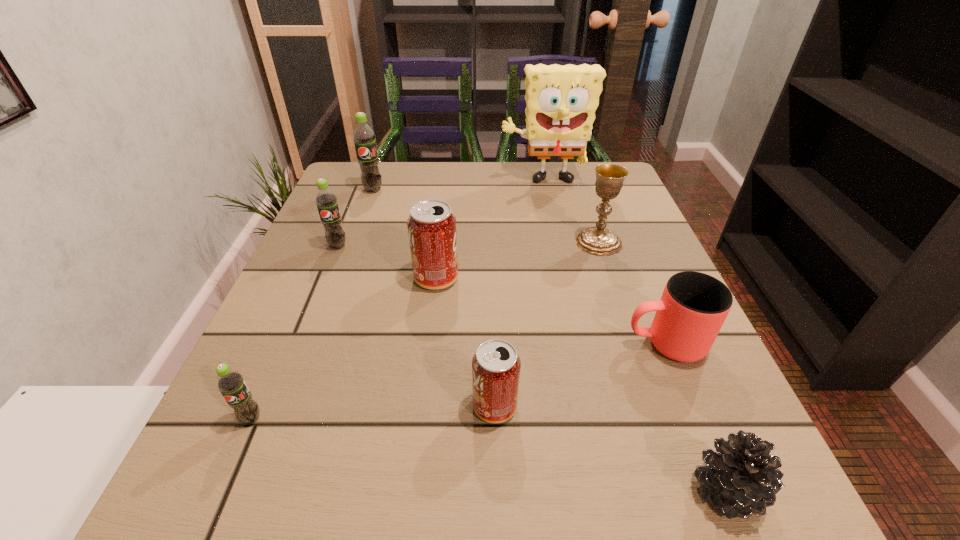
Where is `free space between the smaller red soda can and the pink cup`? This screenshot has width=960, height=540. free space between the smaller red soda can and the pink cup is located at coordinates (580, 375).

Image resolution: width=960 pixels, height=540 pixels. Identify the location of empty space that is in between the left red soda can and the nearest green soda. (344, 348).

Image resolution: width=960 pixels, height=540 pixels. Find the location of `free spot between the nearer red soda can and the bigger red soda can`. free spot between the nearer red soda can and the bigger red soda can is located at coordinates (466, 342).

Where is `object that is the eighth closest to the brown pinecone`? The height and width of the screenshot is (540, 960). object that is the eighth closest to the brown pinecone is located at coordinates (363, 136).

At what (x,y) coordinates should I click in order to perform the action: click on object that ranks as the sixth closest to the smallest green soda. Please return your answer as a coordinate pair (x, y). Image resolution: width=960 pixels, height=540 pixels. Looking at the image, I should click on (363, 136).

Find the location of `soda that is the second closest to the smallest green soda`. soda that is the second closest to the smallest green soda is located at coordinates (432, 232).

Image resolution: width=960 pixels, height=540 pixels. I want to click on soda object that ranks as the closest to the left red soda can, so click(x=326, y=201).

Locate which green soda ranks second in proximity to the smallest green soda. Please provide its 2D coordinates. Your answer should be formatted as a tuple, i.e. [(x, y)], where the tuple contains the x and y coordinates of a point satisfying the conditions above.

[(363, 136)]

Find the location of a particular element. green soda that is the third closest to the smaller red soda can is located at coordinates (363, 136).

Where is `vacant space that satisfies the following two spatial constraints: 1. on the front label of the smallest green soda; 2. on the left side of the brown pinecone`? This screenshot has height=540, width=960. vacant space that satisfies the following two spatial constraints: 1. on the front label of the smallest green soda; 2. on the left side of the brown pinecone is located at coordinates (219, 491).